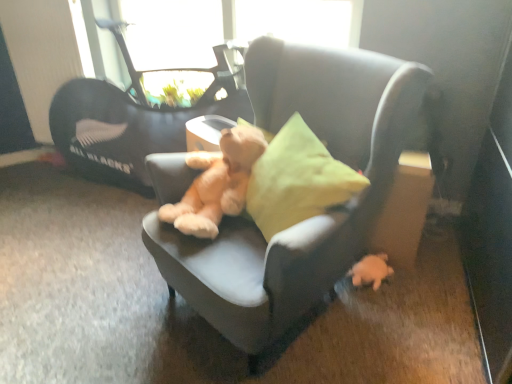
Question: Does soft gray chair at center lie behind soft beige teddy bear at center?

Choices:
 (A) yes
 (B) no

Answer: (B)

Question: Considering the relative sizes of soft gray chair at center and soft beige teddy bear at center in the image provided, is soft gray chair at center bigger than soft beige teddy bear at center?

Choices:
 (A) no
 (B) yes

Answer: (B)

Question: Is soft gray chair at center at the right side of soft beige teddy bear at center?

Choices:
 (A) no
 (B) yes

Answer: (B)

Question: From the image's perspective, is soft gray chair at center located above soft beige teddy bear at center?

Choices:
 (A) yes
 (B) no

Answer: (B)

Question: Does soft gray chair at center lie in front of soft beige teddy bear at center?

Choices:
 (A) no
 (B) yes

Answer: (B)

Question: From a real-world perspective, is soft gray chair at center beneath soft beige teddy bear at center?

Choices:
 (A) no
 (B) yes

Answer: (B)

Question: Is black fabric baby carriage at upper left at the right side of white plush toy at lower right?

Choices:
 (A) no
 (B) yes

Answer: (A)

Question: From a real-world perspective, is black fabric baby carriage at upper left located higher than white plush toy at lower right?

Choices:
 (A) no
 (B) yes

Answer: (B)

Question: Can you confirm if black fabric baby carriage at upper left is thinner than white plush toy at lower right?

Choices:
 (A) no
 (B) yes

Answer: (A)

Question: Is white plush toy at lower right a part of black fabric baby carriage at upper left?

Choices:
 (A) yes
 (B) no

Answer: (B)

Question: Is black fabric baby carriage at upper left not close to white plush toy at lower right?

Choices:
 (A) yes
 (B) no

Answer: (A)

Question: Is black fabric baby carriage at upper left in contact with white plush toy at lower right?

Choices:
 (A) no
 (B) yes

Answer: (A)

Question: Can you confirm if soft beige teddy bear at center is wider than transparent glass window screen at upper center?

Choices:
 (A) yes
 (B) no

Answer: (A)